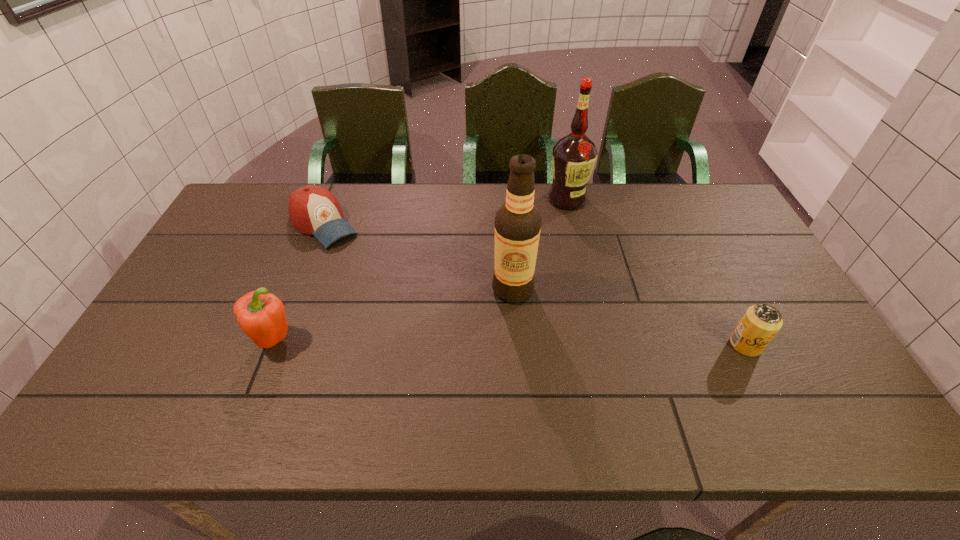
Identify the location of the third tallest object. (261, 316).

The width and height of the screenshot is (960, 540). What are the coordinates of `the rightmost object` in the screenshot? It's located at (761, 322).

Where is `the third farthest object`? the third farthest object is located at coordinates (518, 222).

The width and height of the screenshot is (960, 540). I want to click on the third object from right to left, so click(x=518, y=222).

Find the location of `baseball cap`. baseball cap is located at coordinates (314, 210).

Identify the location of the right alcohol. (574, 156).

Identify the location of the fourth object from left to right. (574, 156).

Locate an element on the screen. The height and width of the screenshot is (540, 960). vacant space located 0.070m on the left of the pepper is located at coordinates (225, 341).

Locate an element on the screen. The width and height of the screenshot is (960, 540). vacant space situated 0.120m on the right of the beer can is located at coordinates (808, 345).

Find the location of `vacant space located on the label of the third farthest object`. vacant space located on the label of the third farthest object is located at coordinates (466, 348).